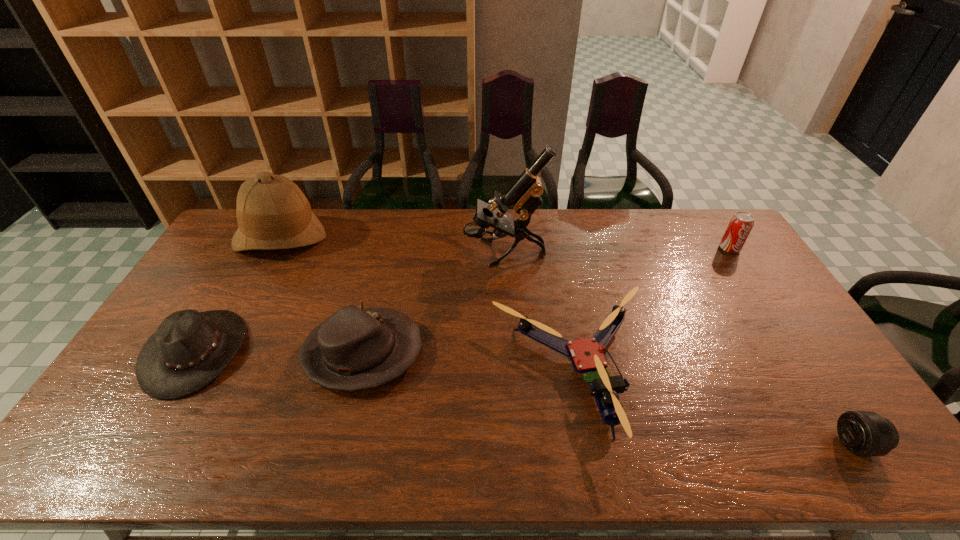
The image size is (960, 540). Find the location of `hat that stands as the second closest to the farthest hat`. hat that stands as the second closest to the farthest hat is located at coordinates (354, 349).

The height and width of the screenshot is (540, 960). Identify the location of free space that satisfies the following two spatial constraints: 1. on the back side of the drone; 2. through the eyepiece of the microscope. (552, 253).

Locate an element on the screen. This screenshot has height=540, width=960. free space that satisfies the following two spatial constraints: 1. on the back side of the drone; 2. through the eyepiece of the tallest object is located at coordinates (552, 253).

Image resolution: width=960 pixels, height=540 pixels. What are the coordinates of `blank area in the image that satisfies the following two spatial constraints: 1. on the logo side of the soda can; 2. on the decorative side of the fifth object from right to left` in the screenshot? It's located at (797, 353).

Where is `vacant point that satisfies the following two spatial constraints: 1. through the eyepiece of the tallest object; 2. on the right side of the drone`? This screenshot has height=540, width=960. vacant point that satisfies the following two spatial constraints: 1. through the eyepiece of the tallest object; 2. on the right side of the drone is located at coordinates (512, 371).